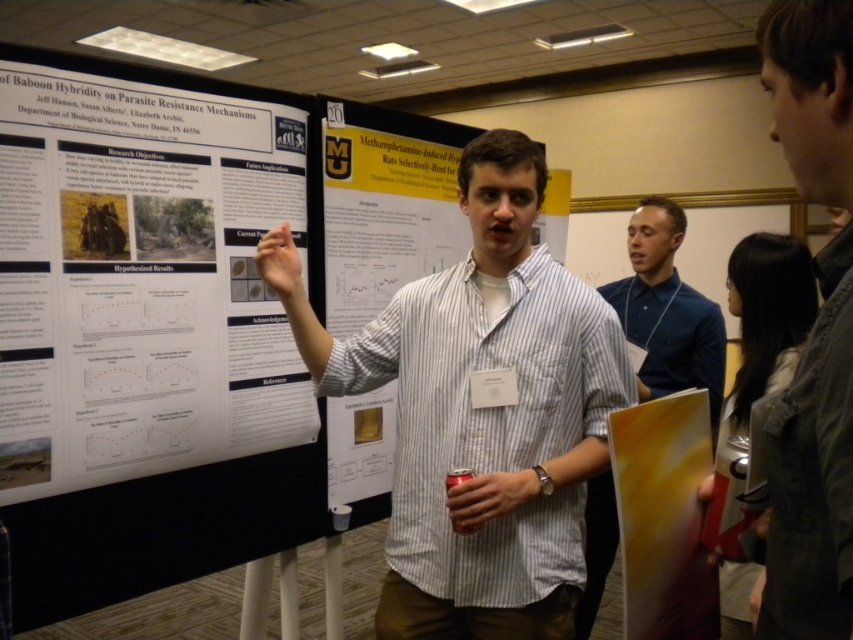
The image size is (853, 640). What do you see at coordinates (480, 412) in the screenshot?
I see `striped cotton shirt at center` at bounding box center [480, 412].

Who is more distant from viewer, (x=445, y=464) or (x=776, y=65)?

The point (x=445, y=464) is behind.

At what (x,y) coordinates should I click in order to perform the action: click on striped cotton shirt at center. Please return your answer as a coordinate pair (x, y). Looking at the image, I should click on (480, 412).

Is gray denim jacket at upper right behind blue fabric shirt at center?

No.

What do you see at coordinates (811, 332) in the screenshot? I see `gray denim jacket at upper right` at bounding box center [811, 332].

Between point (840, 609) and point (682, 221), which one is positioned behind?

Positioned behind is point (682, 221).

Where is `gray denim jacket at upper right`? Image resolution: width=853 pixels, height=640 pixels. gray denim jacket at upper right is located at coordinates (811, 332).

Looking at this image, which is more to the right, striped cotton shirt at center or white striped shirt at center?

From the viewer's perspective, striped cotton shirt at center appears more on the right side.

Is striped cotton shirt at center bigger than white striped shirt at center?

Indeed, striped cotton shirt at center has a larger size compared to white striped shirt at center.

At what (x,y) coordinates should I click in order to perform the action: click on striped cotton shirt at center. Please return your answer as a coordinate pair (x, y). This screenshot has width=853, height=640. Looking at the image, I should click on coord(480,412).

This screenshot has width=853, height=640. Identify the location of striped cotton shirt at center. (480, 412).